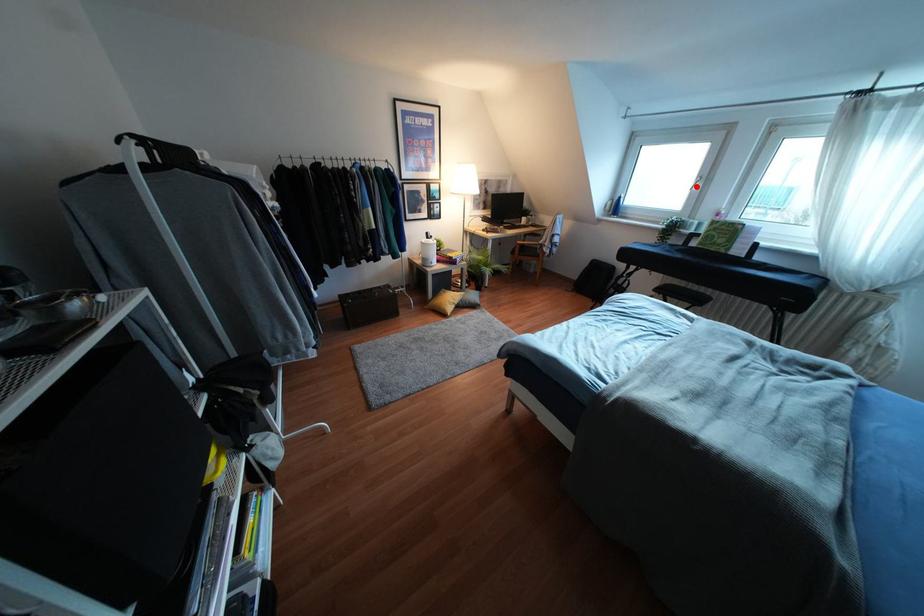
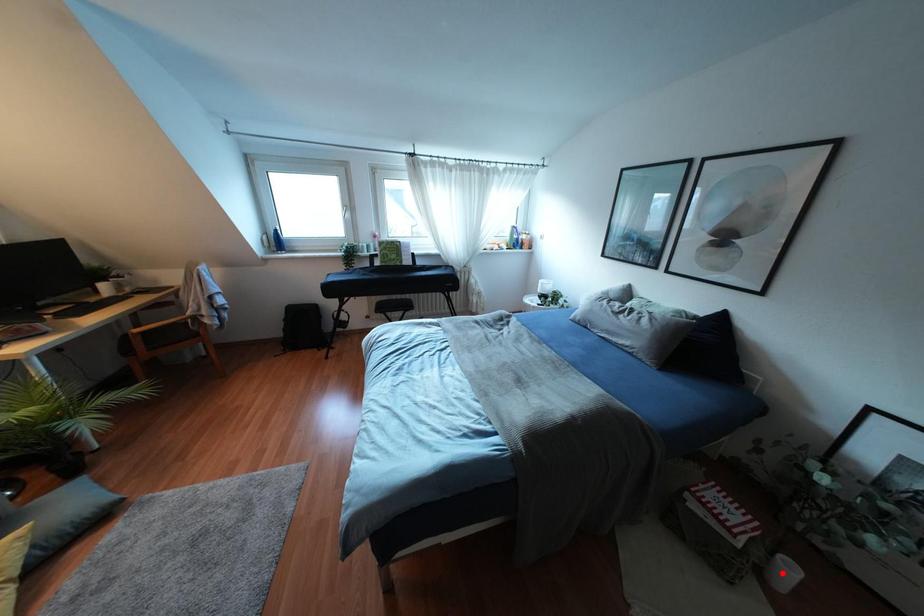
From the picture: I am providing you with two images of the same scene from different viewpoints. A red point is marked on the first image and another point is marked on the second image. Are the points marked in image1 and image2 representing the same 3D position?

No